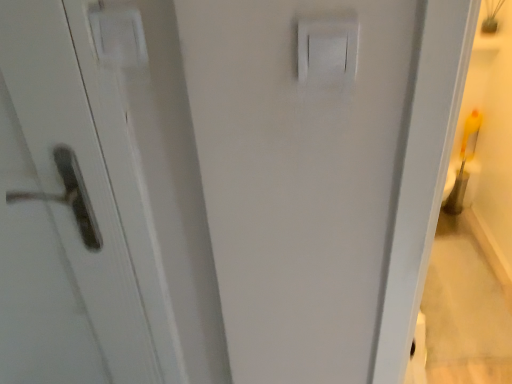
At what (x,y) coordinates should I click in order to perform the action: click on white plastic light switch at upper center. Please return your answer as a coordinate pair (x, y). Looking at the image, I should click on (327, 50).

This screenshot has width=512, height=384. What do you see at coordinates (327, 50) in the screenshot?
I see `white plastic light switch at upper center` at bounding box center [327, 50].

This screenshot has width=512, height=384. I want to click on matte white handle at left, so click(x=73, y=202).

What do you see at coordinates (73, 202) in the screenshot? The height and width of the screenshot is (384, 512). I see `matte white handle at left` at bounding box center [73, 202].

The image size is (512, 384). Identify the location of white plastic light switch at upper center. (327, 50).

Between white plastic light switch at upper center and matte white handle at left, which one appears on the right side from the viewer's perspective?

white plastic light switch at upper center.

Which object is closer to the camera taking this photo, white plastic light switch at upper center or matte white handle at left?

white plastic light switch at upper center is closer to the camera.

Does point (328, 35) appear closer or farther from the camera than point (52, 158)?

Point (328, 35).

From the image's perspective, is white plastic light switch at upper center located above or below matte white handle at left?

From the image's perspective, white plastic light switch at upper center appears above matte white handle at left.

From a real-world perspective, is white plastic light switch at upper center located beneath matte white handle at left?

No.

Considering the relative sizes of white plastic light switch at upper center and matte white handle at left in the image provided, is white plastic light switch at upper center thinner than matte white handle at left?

Yes.

Who is shorter, white plastic light switch at upper center or matte white handle at left?

With less height is white plastic light switch at upper center.

Which of these two, white plastic light switch at upper center or matte white handle at left, is bigger?

matte white handle at left is bigger.

Choose the correct answer: Is white plastic light switch at upper center inside matte white handle at left or outside it?

white plastic light switch at upper center cannot be found inside matte white handle at left.

Is there a large distance between white plastic light switch at upper center and matte white handle at left?

That's not correct — white plastic light switch at upper center is a little close to matte white handle at left.

Is matte white handle at left at the back of white plastic light switch at upper center?

No, white plastic light switch at upper center is not facing away from matte white handle at left.

In the image, there is a white plastic light switch at upper center. Where is `screen door below it (from a real-world perspective)`? screen door below it (from a real-world perspective) is located at coordinates (73, 202).

In the image, is matte white handle at left on the left side or the right side of white plastic light switch at upper center?

Clearly, matte white handle at left is on the left of white plastic light switch at upper center in the image.

Which object is further away from the camera taking this photo, matte white handle at left or white plastic light switch at upper center?

matte white handle at left.

Which is in front, point (116, 344) or point (300, 27)?

The point (300, 27) is closer.

Based on the photo, from the image's perspective, would you say matte white handle at left is positioned over white plastic light switch at upper center?

No, from the image's perspective, matte white handle at left is not above white plastic light switch at upper center.

From a real-world perspective, is matte white handle at left located beneath white plastic light switch at upper center?

Indeed, from a real-world perspective, matte white handle at left is positioned beneath white plastic light switch at upper center.

Considering the sizes of objects matte white handle at left and white plastic light switch at upper center in the image provided, who is thinner, matte white handle at left or white plastic light switch at upper center?

white plastic light switch at upper center is thinner.

From their relative heights in the image, would you say matte white handle at left is taller or shorter than white plastic light switch at upper center?

In the image, matte white handle at left appears to be taller than white plastic light switch at upper center.

Does matte white handle at left have a smaller size compared to white plastic light switch at upper center?

No, matte white handle at left is not smaller than white plastic light switch at upper center.

Choose the correct answer: Is matte white handle at left inside white plastic light switch at upper center or outside it?

matte white handle at left is outside white plastic light switch at upper center.

Is there a large distance between matte white handle at left and white plastic light switch at upper center?

matte white handle at left is actually quite close to white plastic light switch at upper center.

Is matte white handle at left turned away from white plastic light switch at upper center?

matte white handle at left does not have its back to white plastic light switch at upper center.

How many degrees apart are the facing directions of matte white handle at left and white plastic light switch at upper center?

They differ by 0.00806 degrees in their facing directions.

Where is `light switch that is on the right side of matte white handle at left`? The image size is (512, 384). light switch that is on the right side of matte white handle at left is located at coordinates (327, 50).

Where is `screen door lying behind the white plastic light switch at upper center`? Image resolution: width=512 pixels, height=384 pixels. screen door lying behind the white plastic light switch at upper center is located at coordinates [x=73, y=202].

Find the location of `light switch above the matte white handle at left (from the image's perspective)`. light switch above the matte white handle at left (from the image's perspective) is located at coordinates (327, 50).